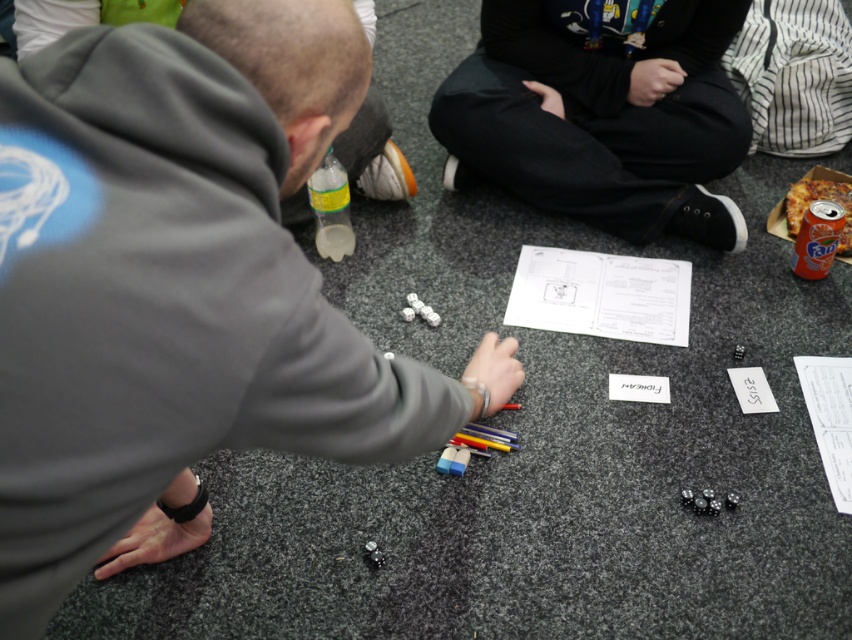
You are a photographer trying to capture a candid shot of the game session. You want to focus on the gray hoodie at center and the black cotton pants at center. From the camera angle shown in the scene, which clothing item is positioned lower in the frame?

The black cotton pants at center is located below gray hoodie at center, so the black cotton pants at center would appear lower in the frame.